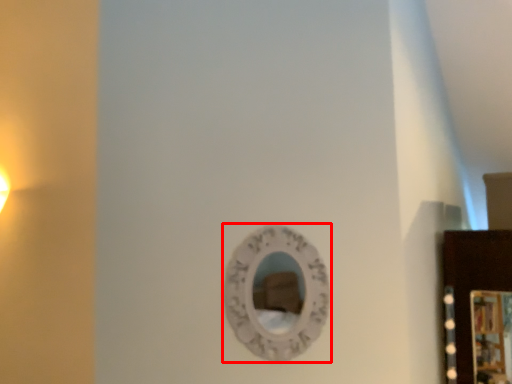
Question: From the image's perspective, considering the relative positions of mirror (annotated by the red box) and picture frame in the image provided, where is mirror (annotated by the red box) located with respect to the staircase?

Choices:
 (A) above
 (B) below

Answer: (A)